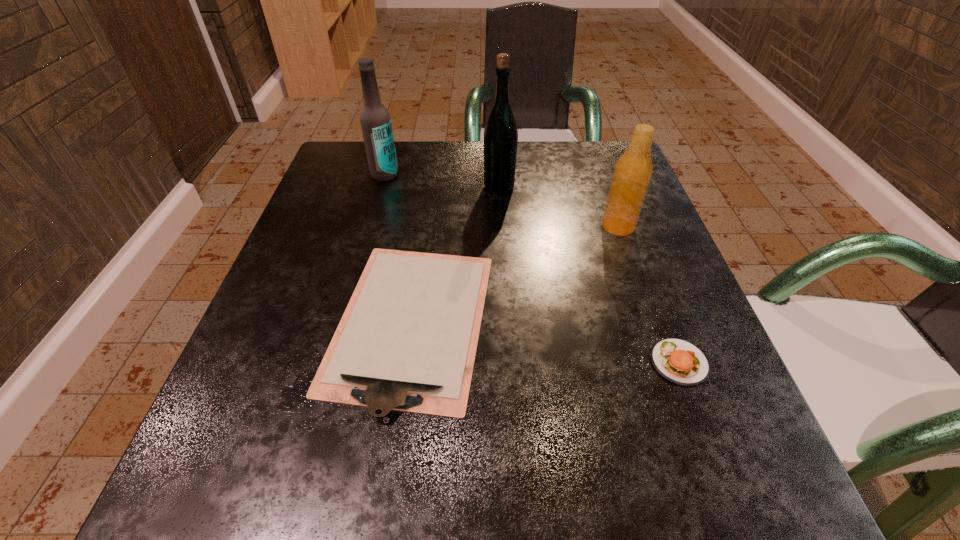
This screenshot has height=540, width=960. In the image, there is a desktop. Identify the location of blank space at the far left corner. (351, 166).

Where is `free space at the far right corner of the desktop`? This screenshot has width=960, height=540. free space at the far right corner of the desktop is located at coordinates (602, 153).

This screenshot has width=960, height=540. I want to click on vacant space that is in between the leftmost beer bottle and the shortest object, so click(398, 248).

Where is `vacant space in between the fourth tallest object and the shortest beer bottle`? The image size is (960, 540). vacant space in between the fourth tallest object and the shortest beer bottle is located at coordinates (648, 294).

Identify the location of free space between the rightmost beer bottle and the shortest object. (515, 274).

Locate an element on the screen. Image resolution: width=960 pixels, height=540 pixels. blank region between the second beer bottle from left to right and the shortest object is located at coordinates (455, 255).

The height and width of the screenshot is (540, 960). What are the coordinates of `vacant space in between the clipboard and the third shortest object` in the screenshot? It's located at (515, 274).

The width and height of the screenshot is (960, 540). In order to click on empty space that is in between the nearest beer bottle and the second shortest object in this screenshot , I will do `click(648, 294)`.

At what (x,y) coordinates should I click in order to perform the action: click on free area in between the second beer bottle from right to left and the clipboard. Please return your answer as a coordinate pair (x, y). Image resolution: width=960 pixels, height=540 pixels. Looking at the image, I should click on (455, 255).

At what (x,y) coordinates should I click in order to perform the action: click on vacant point located between the patty and the third nearest object. Please return your answer as a coordinate pair (x, y). The image size is (960, 540). Looking at the image, I should click on pyautogui.click(x=648, y=294).